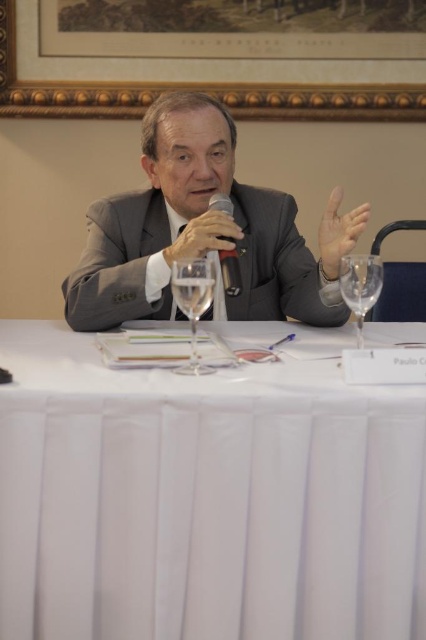
Question: Which point appears closest to the camera in this image?

Choices:
 (A) (347, 266)
 (B) (187, 364)
 (C) (186, 252)

Answer: (B)

Question: Can you confirm if matte gray hand at upper right is positioned to the right of transparent glass wine glass at right?

Choices:
 (A) yes
 (B) no

Answer: (B)

Question: Is clear glass wine glass at center further to camera compared to black plastic microphone at center?

Choices:
 (A) no
 (B) yes

Answer: (A)

Question: From the image, what is the correct spatial relationship of matte gray hand at upper right in relation to transparent glass wine glass at right?

Choices:
 (A) left
 (B) right

Answer: (A)

Question: Estimate the real-world distances between objects in this image. Which object is farther from the matte black microphone at center?

Choices:
 (A) black plastic microphone at center
 (B) white cloth at center
 (C) gray suit at center

Answer: (B)

Question: Which point is closer to the camera?

Choices:
 (A) black plastic microphone at center
 (B) white cloth at center
 (C) matte black microphone at center

Answer: (B)